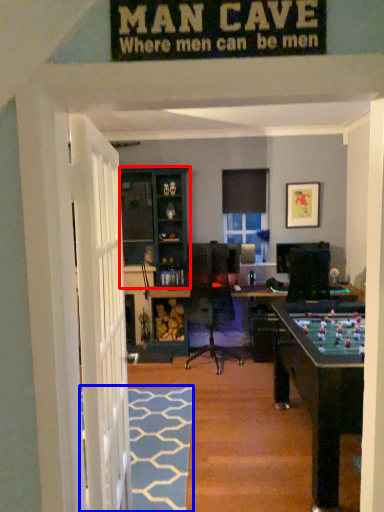
Question: Which object appears farthest to the camera in this image, cabinetry (highlighted by a red box) or doormat (highlighted by a blue box)?

Choices:
 (A) cabinetry
 (B) doormat

Answer: (A)